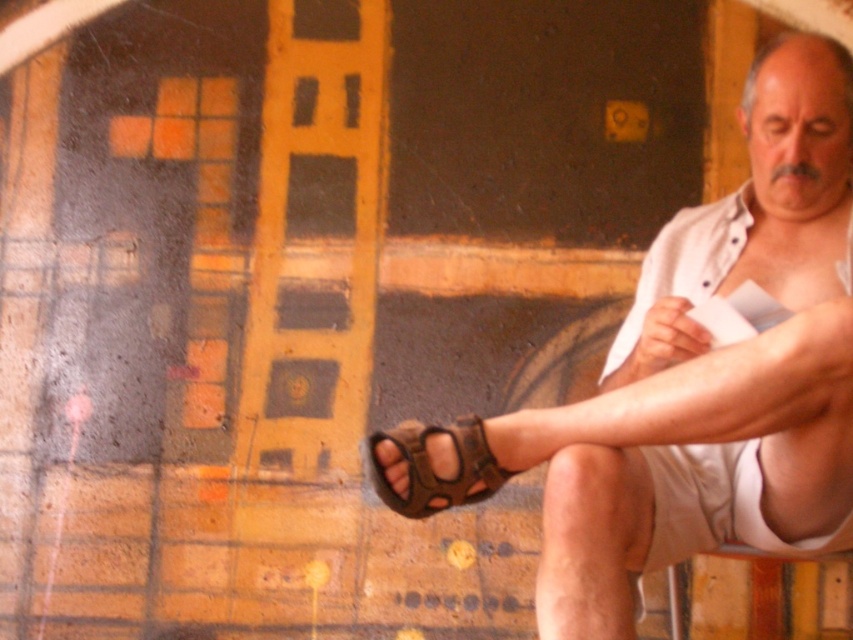
Can you confirm if brown leather sandals at lower left is wider than brown leather sandal at lower right?

Yes, brown leather sandals at lower left is wider than brown leather sandal at lower right.

In the scene shown: Measure the distance between point (808, 177) and camera.

Point (808, 177) and camera are 6.14 feet apart.

Where is `brown leather sandals at lower left`? brown leather sandals at lower left is located at coordinates (691, 380).